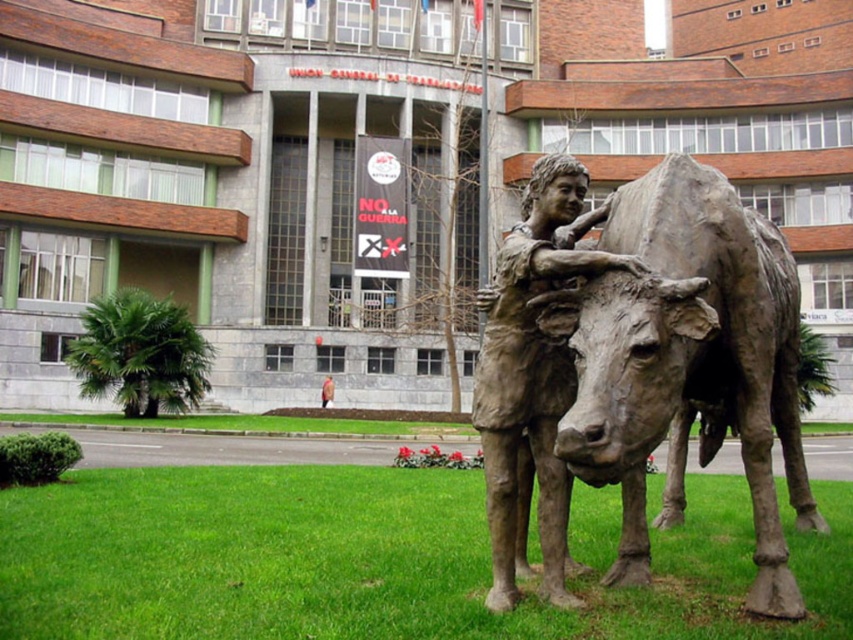
Between point (74, 561) and point (682, 428), which one is positioned behind?

Positioned behind is point (682, 428).

Consider the image. Does green grass at lower center have a smaller size compared to bronze statue at center?

Yes.

The width and height of the screenshot is (853, 640). Describe the element at coordinates (367, 561) in the screenshot. I see `green grass at lower center` at that location.

You are a GUI agent. You are given a task and a screenshot of the screen. Output one action in this format:
    pyautogui.click(x=<x>, y=<y>)
    Task: Click on the green grass at lower center
    
    Given the screenshot: What is the action you would take?
    pyautogui.click(x=367, y=561)